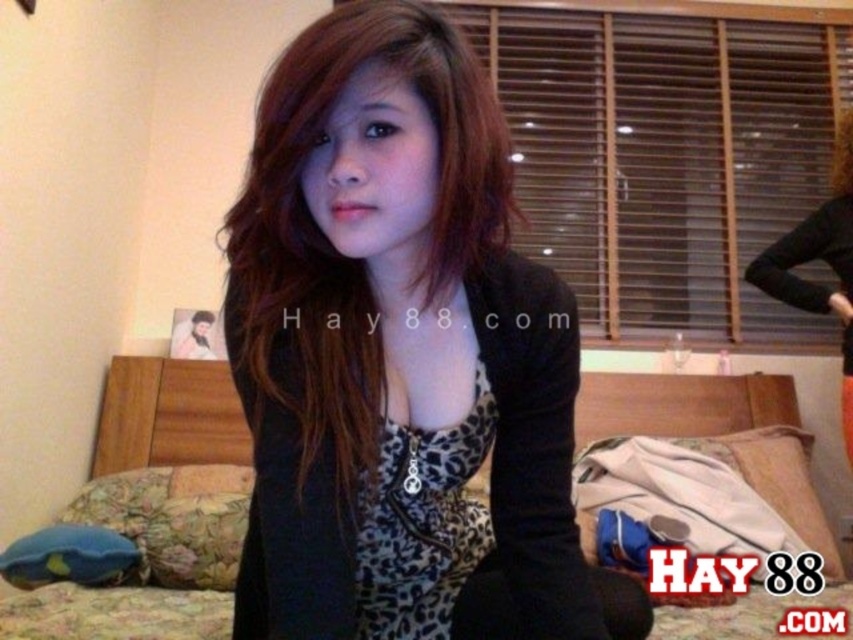
Question: Which point is closer to the camera?

Choices:
 (A) (310, 552)
 (B) (178, 362)

Answer: (A)

Question: Can you confirm if matte black jacket at center is wider than floral fabric bed at center?

Choices:
 (A) yes
 (B) no

Answer: (B)

Question: Is matte black jacket at center in front of floral fabric bed at center?

Choices:
 (A) yes
 (B) no

Answer: (A)

Question: Among these points, which one is nearest to the camera?

Choices:
 (A) (680, 396)
 (B) (601, 627)

Answer: (B)

Question: Which point is farther to the camera?

Choices:
 (A) matte black jacket at center
 (B) floral fabric bed at center

Answer: (B)

Question: Can you confirm if matte black jacket at center is wider than floral fabric bed at center?

Choices:
 (A) yes
 (B) no

Answer: (B)